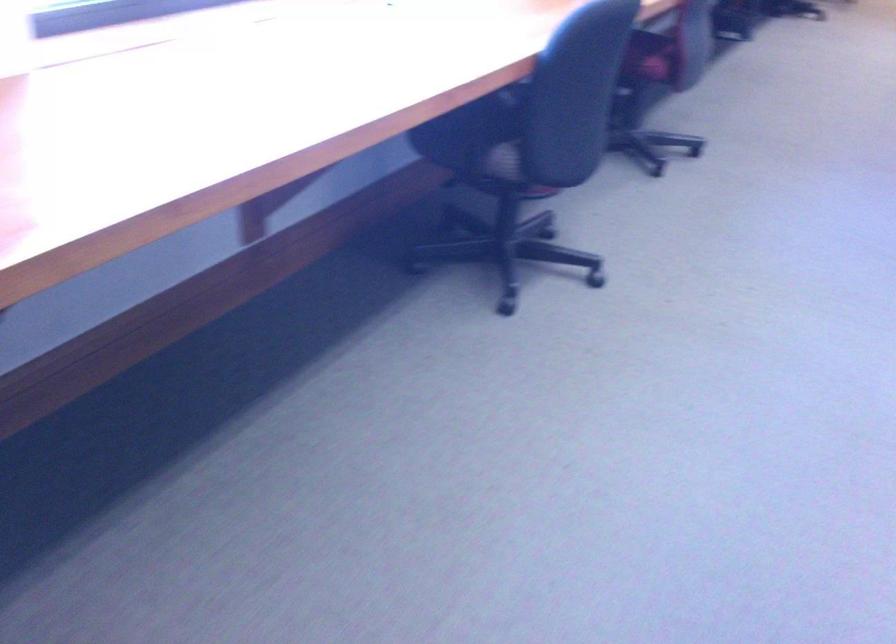
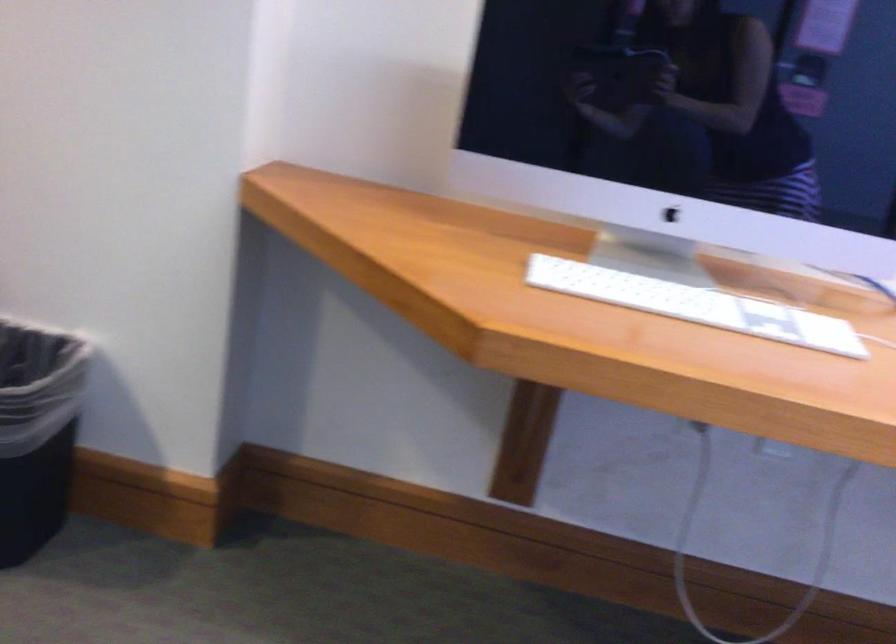
Question: The camera is either moving clockwise (left) or counter-clockwise (right) around the object. The first image is from the beginning of the video and the second image is from the end. Is the camera moving left or right when shooting the video?

Choices:
 (A) Left
 (B) Right

Answer: (B)